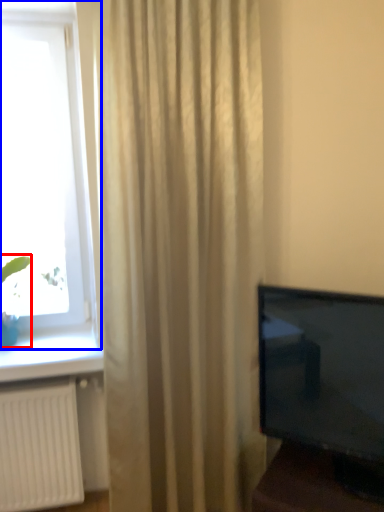
Question: Among these objects, which one is farthest to the camera, plant (highlighted by a red box) or window (highlighted by a blue box)?

Choices:
 (A) plant
 (B) window

Answer: (A)